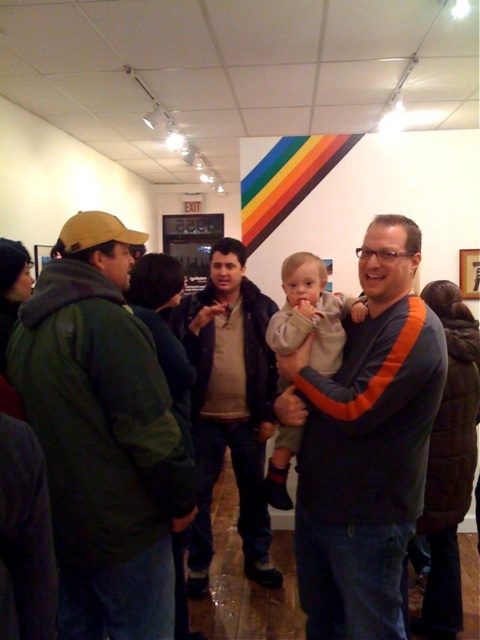
Who is lower down, orange-striped sweater at center or light gray fleece at center?

orange-striped sweater at center is lower down.

Is orange-striped sweater at center below light gray fleece at center?

Indeed, orange-striped sweater at center is positioned under light gray fleece at center.

Identify the location of orange-striped sweater at center. (365, 445).

Describe the element at coordinates (103, 436) in the screenshot. I see `green fleece jacket at left` at that location.

This screenshot has width=480, height=640. I want to click on green fleece jacket at left, so click(x=103, y=436).

Locate an element on the screen. green fleece jacket at left is located at coordinates (103, 436).

Who is higher up, orange-striped sweater at center or dark brown leather jacket at center?

orange-striped sweater at center is above.

Is orange-striped sweater at center below dark brown leather jacket at center?

Incorrect, orange-striped sweater at center is not positioned below dark brown leather jacket at center.

Between point (383, 316) and point (272, 308), which one is positioned in front?

Point (383, 316) is in front.

The width and height of the screenshot is (480, 640). What are the coordinates of `orange-striped sweater at center` in the screenshot? It's located at (365, 445).